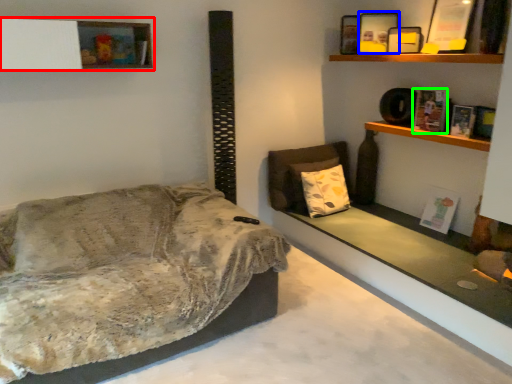
Question: Which object is the closest to the shelf (highlighted by a red box)? Choose among these: picture frame (highlighted by a blue box) or book (highlighted by a green box).

Choices:
 (A) picture frame
 (B) book

Answer: (A)